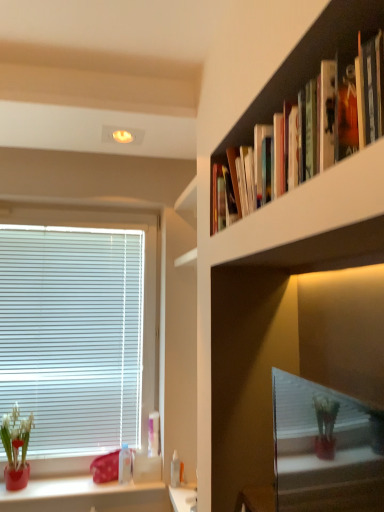
Question: Considering the positions of white glossy vanity at lower center and hardcover books at upper right in the image, is white glossy vanity at lower center wider or thinner than hardcover books at upper right?

Choices:
 (A) wide
 (B) thin

Answer: (A)

Question: Based on their positions, is white glossy vanity at lower center located to the left or right of hardcover books at upper right?

Choices:
 (A) right
 (B) left

Answer: (B)

Question: Which of these objects is positioned farthest from the transparent plastic bottle at lower center, which ranks as the 2th toiletry in left-to-right order?

Choices:
 (A) matte red vase at lower left
 (B) white glossy vanity at lower center
 (C) transparent plastic bottle at lower left, which ranks as the third toiletry in right-to-left order
 (D) white blinds at left
 (E) hardcover books at upper right

Answer: (E)

Question: Estimate the real-world distances between objects in this image. Which object is closer to the white blinds at left?

Choices:
 (A) transparent plastic bottle at lower center, which ranks as the 2th toiletry in left-to-right order
 (B) matte ceramic pot at lower left
 (C) hardcover books at upper right
 (D) white plastic bottle at lower center, marked as the first toiletry in a right-to-left arrangement
 (E) matte red vase at lower left

Answer: (E)